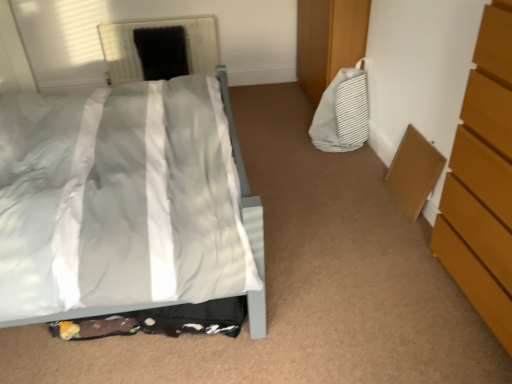
Question: Would you say white glossy bed at center is outside white striped fabric bag at right?

Choices:
 (A) no
 (B) yes

Answer: (B)

Question: Considering the relative sizes of white glossy bed at center and white striped fabric bag at right in the image provided, is white glossy bed at center wider than white striped fabric bag at right?

Choices:
 (A) yes
 (B) no

Answer: (A)

Question: Is white glossy bed at center facing towards white striped fabric bag at right?

Choices:
 (A) yes
 (B) no

Answer: (A)

Question: From a real-world perspective, is white glossy bed at center located higher than white striped fabric bag at right?

Choices:
 (A) yes
 (B) no

Answer: (A)

Question: Does white glossy bed at center appear on the right side of white striped fabric bag at right?

Choices:
 (A) yes
 (B) no

Answer: (B)

Question: From the image's perspective, is white glossy bed at center below white striped fabric bag at right?

Choices:
 (A) yes
 (B) no

Answer: (A)

Question: Is white glossy bed at center at the back of black matte screen door at upper center?

Choices:
 (A) yes
 (B) no

Answer: (B)

Question: Considering the relative positions of black matte screen door at upper center and white glossy bed at center in the image provided, is black matte screen door at upper center behind white glossy bed at center?

Choices:
 (A) no
 (B) yes

Answer: (B)

Question: Is black matte screen door at upper center at the left side of white glossy bed at center?

Choices:
 (A) no
 (B) yes

Answer: (A)

Question: Is black matte screen door at upper center beside white glossy bed at center?

Choices:
 (A) yes
 (B) no

Answer: (B)

Question: From the image's perspective, is black matte screen door at upper center above white glossy bed at center?

Choices:
 (A) yes
 (B) no

Answer: (A)

Question: Is the depth of black matte screen door at upper center less than that of white glossy bed at center?

Choices:
 (A) yes
 (B) no

Answer: (B)

Question: Is wooden chest of drawers at right to the left of white striped fabric bag at right from the viewer's perspective?

Choices:
 (A) no
 (B) yes

Answer: (A)